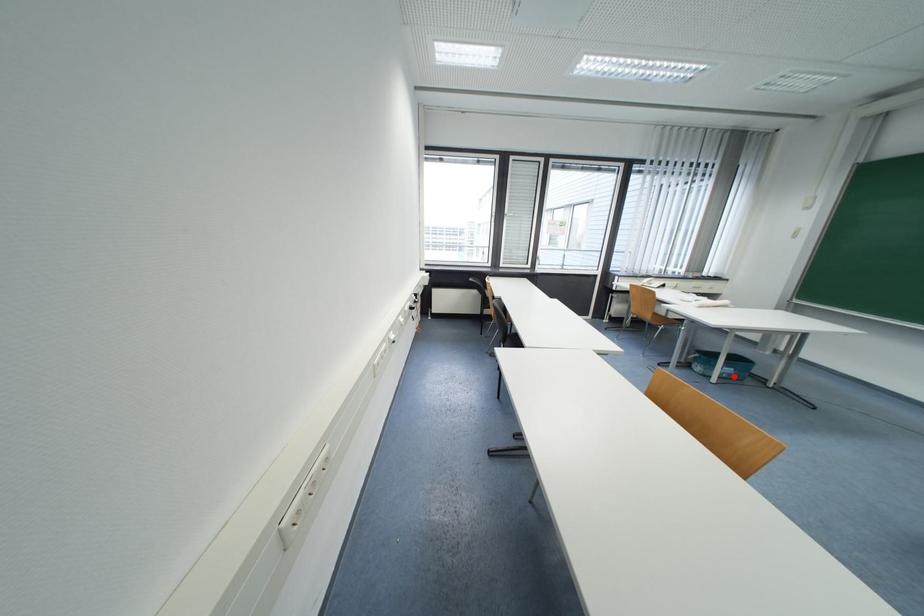
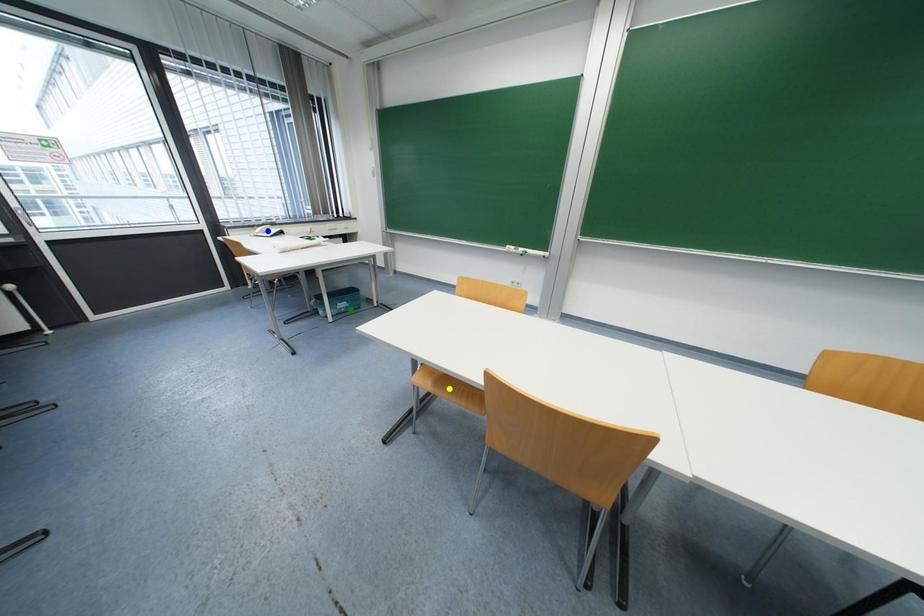
Question: I am providing you with two images of the same scene from different viewpoints. A red point is marked on the first image. You are given multiple points on the second image. Which point in image 2 represents the same 3d spot as the red point in image 1?

Choices:
 (A) green point
 (B) yellow point
 (C) blue point

Answer: (A)